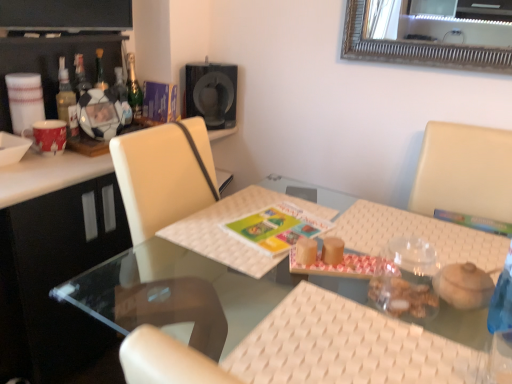
What do you see at coordinates (134, 88) in the screenshot? This screenshot has width=512, height=384. I see `green glass bottle at upper left, marked as the first bottle in a back-to-front arrangement` at bounding box center [134, 88].

You are a GUI agent. You are given a task and a screenshot of the screen. Output one action in this format:
    pyautogui.click(x=<x>, y=<y>)
    Task: Click on the black matte speaker at upper center
    
    Given the screenshot: What is the action you would take?
    pyautogui.click(x=211, y=93)

Locate an element on the screen. The width and height of the screenshot is (512, 384). red glossy mug at left is located at coordinates (47, 136).

Image resolution: width=512 pixels, height=384 pixels. Describe the element at coordinates (47, 136) in the screenshot. I see `red glossy mug at left` at that location.

Where is `white woven placemat at center, the second place mat in the right-to-left sequence`? This screenshot has height=384, width=512. white woven placemat at center, the second place mat in the right-to-left sequence is located at coordinates (230, 233).

Identify the location of green glass bottle at upper left, marked as the first bottle in a back-to-front arrangement. The image size is (512, 384). (134, 88).

Between point (490, 239) and point (60, 88), which one is positioned in front?

The point (490, 239) is closer to the camera.

Considering the relative sizes of white woven placemat at right, arranged as the second place mat when viewed from the left, and translucent glass bottle at left, the third bottle positioned from the back, in the image provided, is white woven placemat at right, arranged as the second place mat when viewed from the left, taller than translucent glass bottle at left, the third bottle positioned from the back,?

No.

Does white woven placemat at right, arranged as the first place mat when viewed from the right, lie in front of translucent glass bottle at left, the third bottle positioned from the back?

Yes, it is.

Is white woven placemat at right, arranged as the first place mat when viewed from the right, completely or partially outside of translucent glass bottle at left, marked as the first bottle in a front-to-back arrangement?

Yes, white woven placemat at right, arranged as the first place mat when viewed from the right, is not within translucent glass bottle at left, marked as the first bottle in a front-to-back arrangement.

Measure the distance between white matte bowl at upper left and red glossy mug at left.

white matte bowl at upper left is 2.92 inches from red glossy mug at left.

Consider the image. Considering the relative sizes of white matte bowl at upper left and red glossy mug at left in the image provided, is white matte bowl at upper left thinner than red glossy mug at left?

In fact, white matte bowl at upper left might be wider than red glossy mug at left.

Is white matte bowl at upper left directly adjacent to red glossy mug at left?

Indeed, white matte bowl at upper left and red glossy mug at left are beside each other and touching.

From the image's perspective, is translucent glass bottle at upper left, positioned as the second bottle in front-to-back order, located above matte plastic soccer ball at left?

Correct, translucent glass bottle at upper left, positioned as the second bottle in front-to-back order, appears higher than matte plastic soccer ball at left in the image.

Which point is more forward, (x=120, y=96) or (x=99, y=98)?

The point (x=99, y=98) is more forward.

Locate an element on the screen. The width and height of the screenshot is (512, 384). picture frame below the translucent glass bottle at upper left, positioned as the second bottle in front-to-back order (from the image's perspective) is located at coordinates (99, 114).

Considering the relative sizes of translucent glass bottle at upper left, positioned as the second bottle in front-to-back order, and matte plastic soccer ball at left in the image provided, is translucent glass bottle at upper left, positioned as the second bottle in front-to-back order, smaller than matte plastic soccer ball at left?

Correct, translucent glass bottle at upper left, positioned as the second bottle in front-to-back order, occupies less space than matte plastic soccer ball at left.

Is green glass bottle at upper left, marked as the first bottle in a back-to-front arrangement, situated inside translucent glass bottle at left, the third bottle positioned from the back, or outside?

green glass bottle at upper left, marked as the first bottle in a back-to-front arrangement, is not enclosed by translucent glass bottle at left, the third bottle positioned from the back.

From the picture: Considering the sizes of objects green glass bottle at upper left, the 3th bottle from the front, and translucent glass bottle at left, marked as the first bottle in a front-to-back arrangement, in the image provided, who is wider, green glass bottle at upper left, the 3th bottle from the front, or translucent glass bottle at left, marked as the first bottle in a front-to-back arrangement,?

translucent glass bottle at left, marked as the first bottle in a front-to-back arrangement, is wider.

From a real-world perspective, who is located higher, green glass bottle at upper left, marked as the first bottle in a back-to-front arrangement, or translucent glass bottle at left, the third bottle positioned from the back?

green glass bottle at upper left, marked as the first bottle in a back-to-front arrangement, from a real-world perspective.

Can you confirm if translucent glass bottle at upper left, positioned as the second bottle in front-to-back order, is taller than white woven placemat at center, which is the first place mat in left-to-right order?

Indeed, translucent glass bottle at upper left, positioned as the second bottle in front-to-back order, has a greater height compared to white woven placemat at center, which is the first place mat in left-to-right order.

Considering the positions of points (115, 74) and (196, 214), is point (115, 74) farther from camera compared to point (196, 214)?

That is True.

Is translucent glass bottle at upper left, which ranks as the second bottle in back-to-front order, bigger or smaller than white woven placemat at center, the second place mat in the right-to-left sequence?

Considering their sizes, translucent glass bottle at upper left, which ranks as the second bottle in back-to-front order, takes up less space than white woven placemat at center, the second place mat in the right-to-left sequence.

Find the location of `the 2nd place mat positioned below the translucent glass bottle at upper left, which ranks as the second bottle in back-to-front order (from a real-world perspective)`. the 2nd place mat positioned below the translucent glass bottle at upper left, which ranks as the second bottle in back-to-front order (from a real-world perspective) is located at coordinates (230, 233).

Is white woven placemat at center, which is the first place mat in left-to-right order, looking in the opposite direction of translucent glass bottle at upper left, positioned as the second bottle in front-to-back order?

No, white woven placemat at center, which is the first place mat in left-to-right order, is not facing the opposite direction of translucent glass bottle at upper left, positioned as the second bottle in front-to-back order.

Which of these two, white woven placemat at center, the second place mat in the right-to-left sequence, or translucent glass bottle at upper left, positioned as the second bottle in front-to-back order, is thinner?

translucent glass bottle at upper left, positioned as the second bottle in front-to-back order.

Are white woven placemat at center, which is the first place mat in left-to-right order, and translucent glass bottle at upper left, positioned as the second bottle in front-to-back order, far apart?

No, white woven placemat at center, which is the first place mat in left-to-right order, is not far from translucent glass bottle at upper left, positioned as the second bottle in front-to-back order.

From the image's perspective, would you say white woven placemat at center, which is the first place mat in left-to-right order, is positioned over translucent glass bottle at upper left, which ranks as the second bottle in back-to-front order?

No.

From the image's perspective, which is below, green glass bottle at upper left, the 3th bottle from the front, or red glossy mug at left?

red glossy mug at left.

Considering the positions of objects green glass bottle at upper left, the 3th bottle from the front, and red glossy mug at left in the image provided, who is more to the right, green glass bottle at upper left, the 3th bottle from the front, or red glossy mug at left?

Positioned to the right is green glass bottle at upper left, the 3th bottle from the front.

Is green glass bottle at upper left, the 3th bottle from the front, inside the boundaries of red glossy mug at left, or outside?

green glass bottle at upper left, the 3th bottle from the front, is not enclosed by red glossy mug at left.

I want to click on place mat that is the 2nd object located below the translucent glass bottle at left, the third bottle positioned from the back (from the image's perspective), so click(417, 235).

Locate an element on the screen. This screenshot has height=384, width=512. coffee cup that is above the white matte bowl at upper left (from the image's perspective) is located at coordinates (47, 136).

When comparing their distances from translucent plastic container at table center, does translucent glass bottle at upper left, positioned as the second bottle in front-to-back order, or translucent glass bottle at left, marked as the first bottle in a front-to-back arrangement, seem further?

translucent glass bottle at upper left, positioned as the second bottle in front-to-back order, is positioned further to the anchor translucent plastic container at table center.

When comparing their distances from clear glass table at center, does green glass bottle at upper left, the 3th bottle from the front, or matte plastic soccer ball at left seem closer?

matte plastic soccer ball at left.

When comparing their distances from white woven placemat at center, the second place mat in the right-to-left sequence, does white matte bowl at upper left or translucent plastic container at table center seem further?

Based on the image, white matte bowl at upper left appears to be further to white woven placemat at center, the second place mat in the right-to-left sequence.

From the picture: Considering their positions, is red glossy mug at left positioned closer to white matte bowl at upper left than white woven mat at center?

Answer: red glossy mug at left is closer to white matte bowl at upper left.

From the image, which object appears to be nearer to green glass bottle at upper left, marked as the first bottle in a back-to-front arrangement, white woven placemat at center, the second place mat in the right-to-left sequence, or translucent glass bottle at upper left, positioned as the second bottle in front-to-back order?

translucent glass bottle at upper left, positioned as the second bottle in front-to-back order, is closer to green glass bottle at upper left, marked as the first bottle in a back-to-front arrangement.

Considering their positions, is translucent glass bottle at upper left, positioned as the second bottle in front-to-back order, positioned closer to translucent plastic container at table center than black matte speaker at upper center?

black matte speaker at upper center is closer to translucent plastic container at table center.

Looking at the image, which one is located further to black matte speaker at upper center, white matte bowl at upper left or white woven mat at left?

The object further to black matte speaker at upper center is white woven mat at left.

Based on the photo, looking at the image, which one is located closer to translucent plastic container at table center, red glossy mug at left or white woven mat at left?

The object closer to translucent plastic container at table center is white woven mat at left.

The width and height of the screenshot is (512, 384). I want to click on speaker positioned between white woven placemat at center, which is the first place mat in left-to-right order, and green glass bottle at upper left, marked as the first bottle in a back-to-front arrangement, from near to far, so [x=211, y=93].

Identify the location of picture frame located between white woven placemat at center, which is the first place mat in left-to-right order, and green glass bottle at upper left, the 3th bottle from the front, in the depth direction. (99, 114).

The height and width of the screenshot is (384, 512). In order to click on chair between clear glass table at center and white woven placemat at center, which is the first place mat in left-to-right order, in the front-back direction in this screenshot , I will do `click(307, 349)`.

You are a GUI agent. You are given a task and a screenshot of the screen. Output one action in this format:
    pyautogui.click(x=<x>, y=<y>)
    Task: Click on the food between white woven mat at center and matte plastic soccer ball at left from front to back
    The width and height of the screenshot is (512, 384).
    Given the screenshot: What is the action you would take?
    pyautogui.click(x=403, y=297)